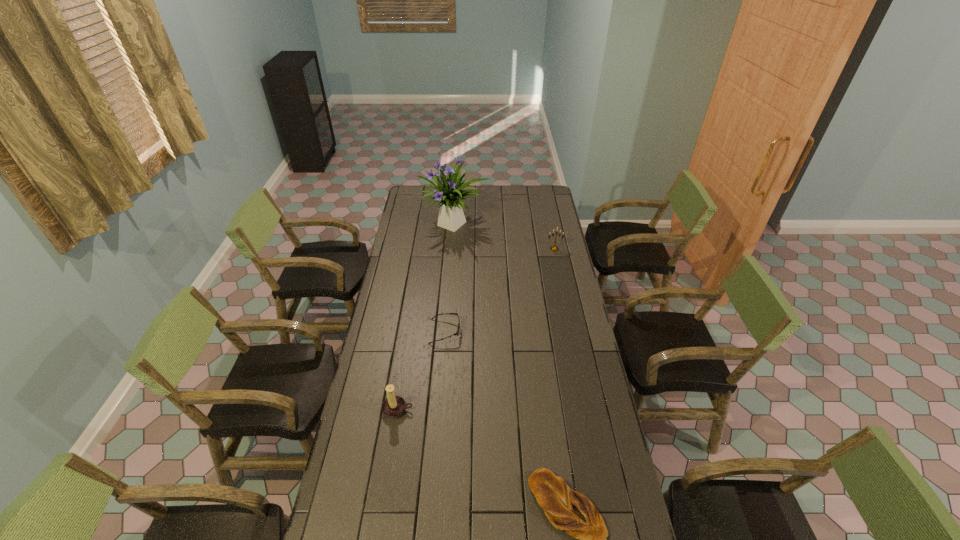
You are a GUI agent. You are given a task and a screenshot of the screen. Output one action in this format:
    pyautogui.click(x=<x>, y=<y>)
    Task: Click on the free spot between the sunglasses and the second nearest object
    
    Given the screenshot: What is the action you would take?
    pyautogui.click(x=421, y=370)

The width and height of the screenshot is (960, 540). In order to click on object identified as the third closest to the right candelabrum in this screenshot , I will do `click(393, 406)`.

I want to click on object that ranks as the second closest to the sunglasses, so click(x=450, y=192).

The height and width of the screenshot is (540, 960). Find the location of `vacant area in the image that satisfies the following two spatial constraints: 1. on the front-facing side of the third nearest object; 2. on the wick of the second nearest object`. vacant area in the image that satisfies the following two spatial constraints: 1. on the front-facing side of the third nearest object; 2. on the wick of the second nearest object is located at coordinates (439, 410).

Identify the location of vacant area that satisfies the following two spatial constraints: 1. on the front-facing side of the third farthest object; 2. on the wick of the fourth farthest object. (439, 410).

You are a GUI agent. You are given a task and a screenshot of the screen. Output one action in this format:
    pyautogui.click(x=<x>, y=<y>)
    Task: Click on the free space that satisfies the following two spatial constraints: 1. on the front side of the right candelabrum; 2. on the front-facing side of the third farthest object
    The width and height of the screenshot is (960, 540).
    Given the screenshot: What is the action you would take?
    pyautogui.click(x=572, y=332)